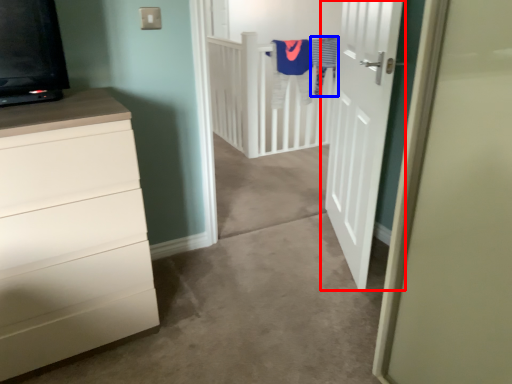
Question: Which object is closer to the camera taking this photo, door (highlighted by a red box) or laundry (highlighted by a blue box)?

Choices:
 (A) door
 (B) laundry

Answer: (A)